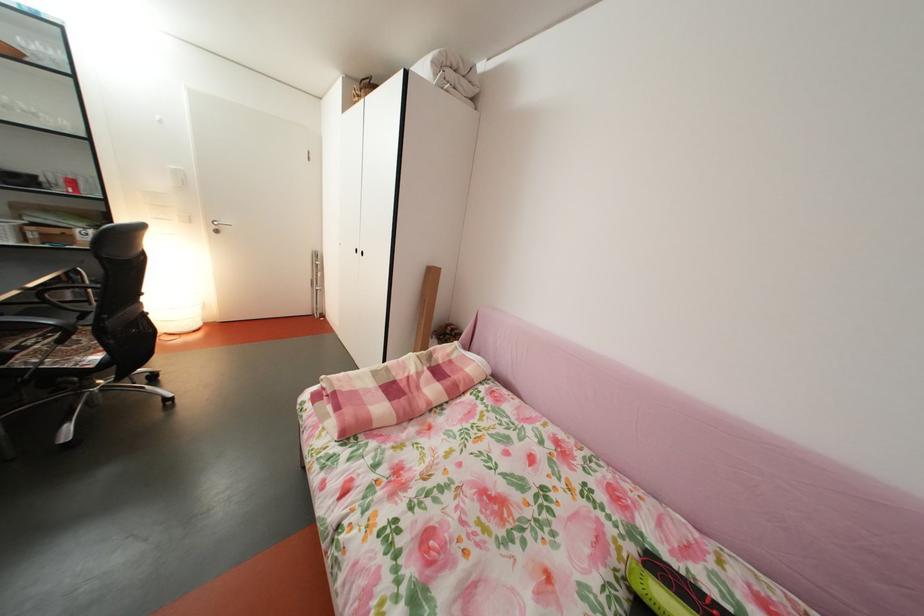
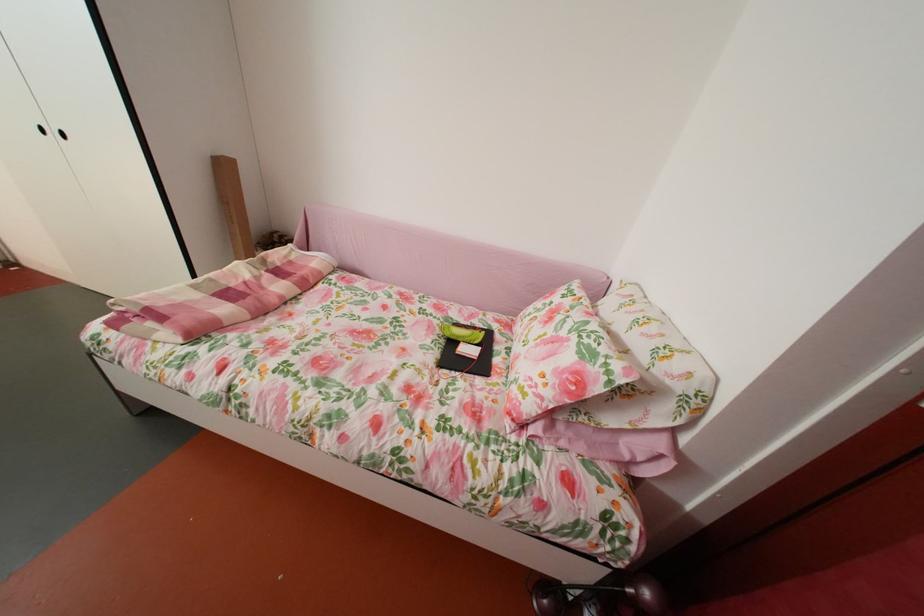
Find the pixel in the second image that matches (x=436, y=375) in the first image.

(274, 278)